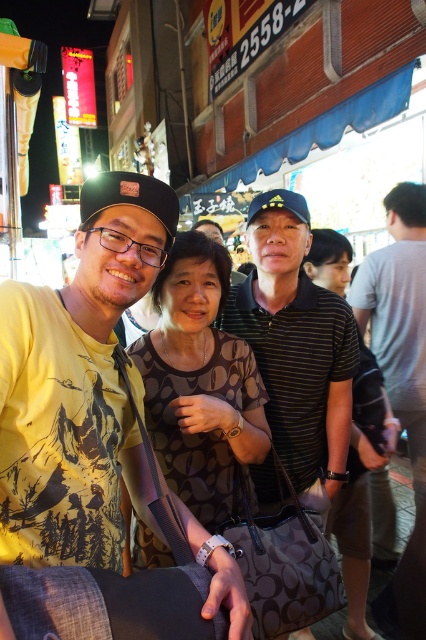
In the night scene, there are two people at the center wearing striped shirts. The first is wearing a striped cotton polo shirt at center and the second is wearing a black striped shirt at center. From the perspective of someone standing in front of them, which shirt is positioned to the left?

The striped cotton polo shirt at center is positioned to the left of the black striped shirt at center.